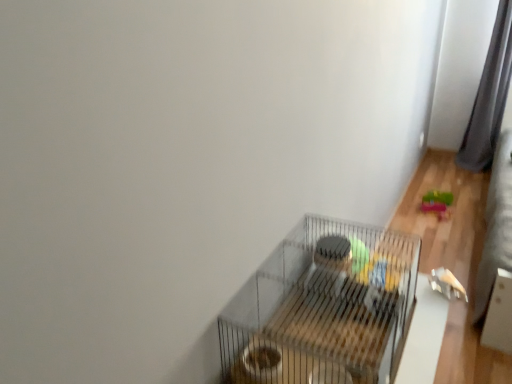
Question: Is gray fabric curtain at right smaller than metallic wire birdcage at center?

Choices:
 (A) no
 (B) yes

Answer: (A)

Question: Is gray fabric curtain at right oriented away from metallic wire birdcage at center?

Choices:
 (A) yes
 (B) no

Answer: (B)

Question: From a real-world perspective, does gray fabric curtain at right stand above metallic wire birdcage at center?

Choices:
 (A) yes
 (B) no

Answer: (A)

Question: From the image's perspective, does gray fabric curtain at right appear higher than metallic wire birdcage at center?

Choices:
 (A) yes
 (B) no

Answer: (A)

Question: Are gray fabric curtain at right and metallic wire birdcage at center making contact?

Choices:
 (A) yes
 (B) no

Answer: (B)

Question: Does gray fabric curtain at right come behind metallic wire birdcage at center?

Choices:
 (A) no
 (B) yes

Answer: (B)

Question: Is gray fabric curtain at right completely or partially outside of rubberized green toy at lower right?

Choices:
 (A) no
 (B) yes

Answer: (B)

Question: From a real-world perspective, is gray fabric curtain at right physically below rubberized green toy at lower right?

Choices:
 (A) no
 (B) yes

Answer: (A)

Question: Does gray fabric curtain at right have a larger size compared to rubberized green toy at lower right?

Choices:
 (A) no
 (B) yes

Answer: (B)

Question: Are gray fabric curtain at right and rubberized green toy at lower right beside each other?

Choices:
 (A) yes
 (B) no

Answer: (B)

Question: Is gray fabric curtain at right smaller than rubberized green toy at lower right?

Choices:
 (A) no
 (B) yes

Answer: (A)

Question: Is gray fabric curtain at right positioned in front of rubberized green toy at lower right?

Choices:
 (A) no
 (B) yes

Answer: (A)

Question: Considering the relative sizes of metallic wire birdcage at center and gray fabric curtain at right in the image provided, is metallic wire birdcage at center shorter than gray fabric curtain at right?

Choices:
 (A) yes
 (B) no

Answer: (A)